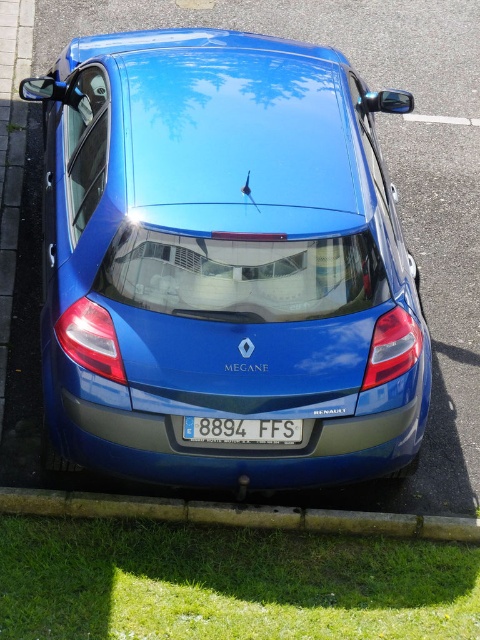
Does point (61, 84) lie in front of point (184, 433)?

No, (61, 84) is further to viewer.

Does glossy blue car at center appear on the left side of white plastic license plate at center?

Indeed, glossy blue car at center is positioned on the left side of white plastic license plate at center.

Is point (223, 163) closer to viewer compared to point (204, 438)?

No, (223, 163) is behind (204, 438).

The width and height of the screenshot is (480, 640). I want to click on glossy blue car at center, so click(224, 260).

Who is taller, green grass at lower left or white plastic license plate at center?

green grass at lower left

Is green grass at lower left above white plastic license plate at center?

No.

At what (x,y) coordinates should I click in order to perform the action: click on green grass at lower left. Please return your answer as a coordinate pair (x, y). The height and width of the screenshot is (640, 480). Looking at the image, I should click on (228, 582).

Who is lower down, green grass at lower center or white plastic license plate at center?

green grass at lower center

Describe the element at coordinates (237, 515) in the screenshot. I see `green grass at lower center` at that location.

This screenshot has width=480, height=640. Identify the location of green grass at lower center. (237, 515).